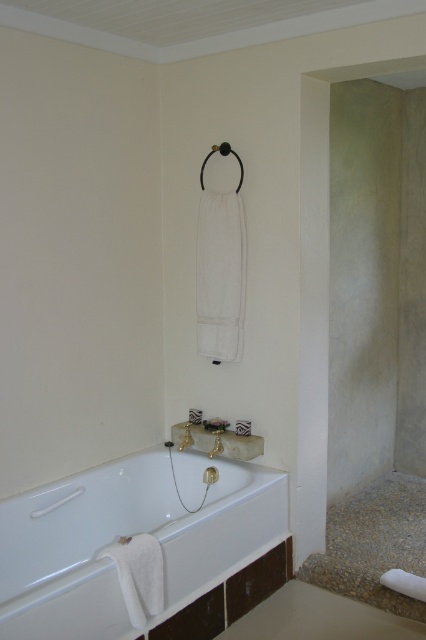
You are standing in the bathroom and want to grab a towel. The white glossy bathtub at lower left and the white fabric towel bar at upper center are in your line of sight. Which object is nearer to you?

The white glossy bathtub at lower left is closer to the viewer than the white fabric towel bar at upper center, so you should reach for the white glossy bathtub at lower left first.

You are designing a bathroom layout and need to ensure that the white glossy bathtub at lower left and the white fabric towel bar at upper center are positioned correctly. Based on their heights, which object should be placed lower to avoid blocking the other?

The white glossy bathtub at lower left has a greater height compared to the white fabric towel bar at upper center, so the white fabric towel bar at upper center should be placed lower to avoid being blocked by the bathtub.

You are a guest in this bathroom and want to place a small decorative item on the white fabric towel bar at upper center. However, you notice the white glossy bathtub at lower left. Is there enough space between them to place the item without it falling into the bathtub?

The white glossy bathtub at lower left is positioned over the white fabric towel bar at upper center, so placing an item on the towel bar might cause it to fall into the bathtub since they are vertically aligned.